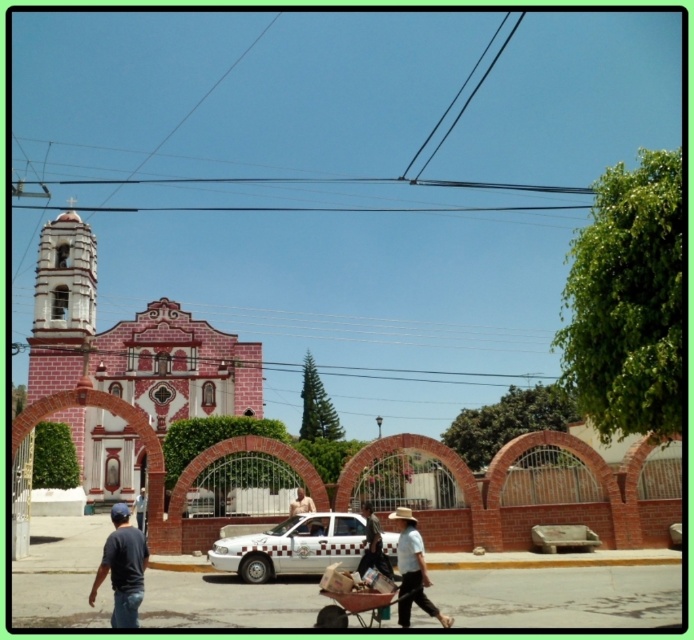
From the picture: You are a pedestrian standing at the entrance of the historic church. You see a white glossy taxi at center and a light brown straw hat at center. Which object is closer to you?

The white glossy taxi at center and light brown straw hat at center are 7.92 meters apart, so it is impossible to determine which is closer without additional information about their exact positions relative to your location.

You are a pedestrian standing at the entrance of the historic church. You see a white glossy taxi at center and a skinny man at center. Which object is closer to you?

The white glossy taxi at center and the skinny man at center are both at the same distance from you since they are both at the center of the scene.

You are a photographer standing in front of the historic church. You see a white glossy taxi at center and a dark blue shirt at lower left. Which object is wider?

The white glossy taxi at center is wider than the dark blue shirt at lower left.